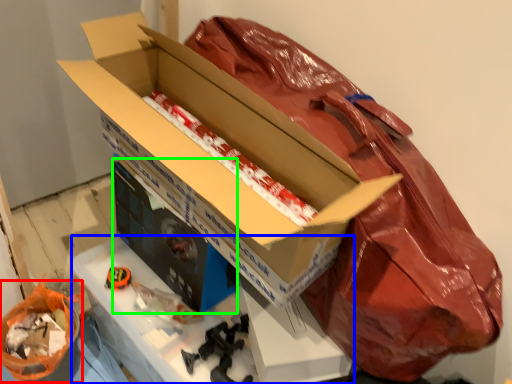
Question: Based on their relative distances, which object is nearer to wrapping paper (highlighted by a red box)? Choose from workbench (highlighted by a blue box) and box (highlighted by a green box).

Choices:
 (A) workbench
 (B) box

Answer: (A)